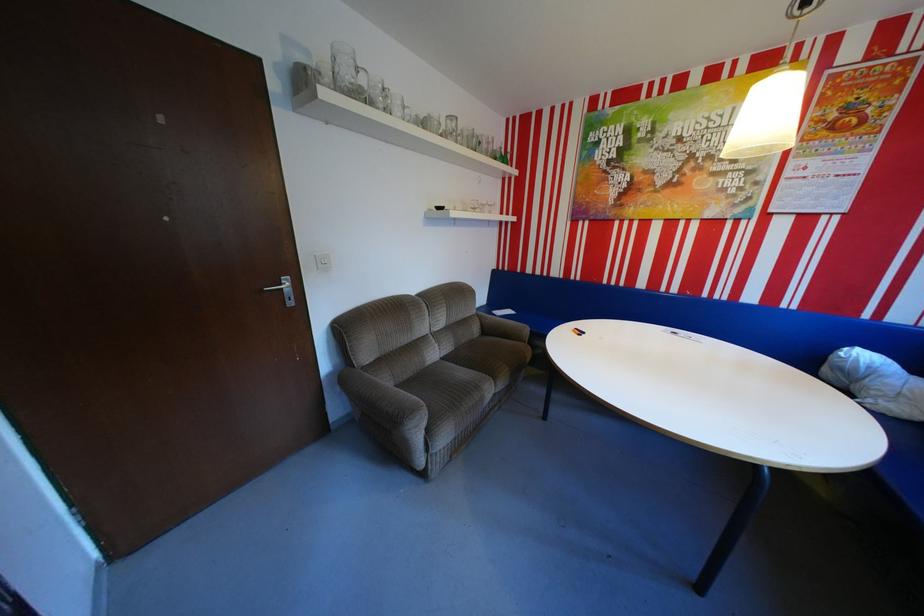
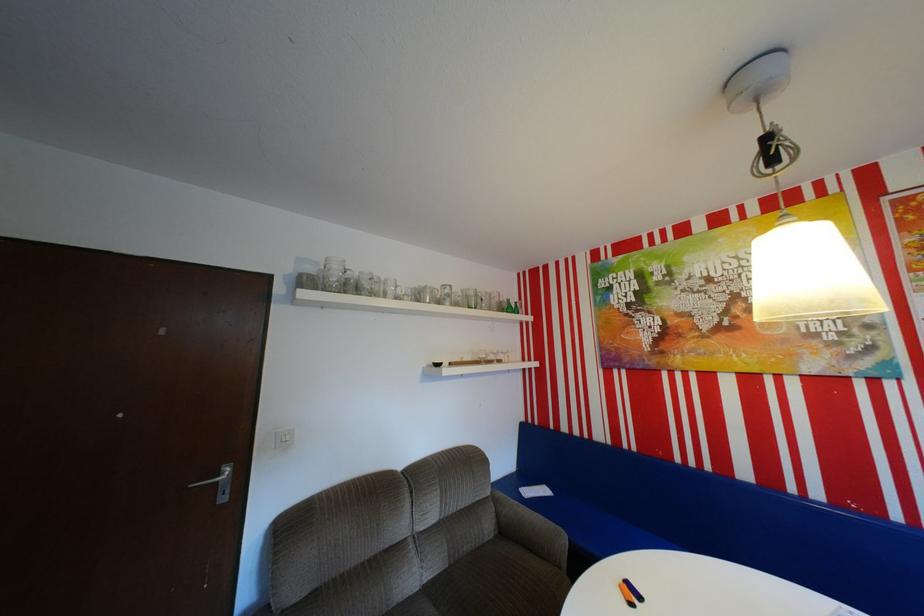
The images are taken continuously from a first-person perspective. In which direction is your viewpoint rotating?

The camera's rotation is toward left-up.